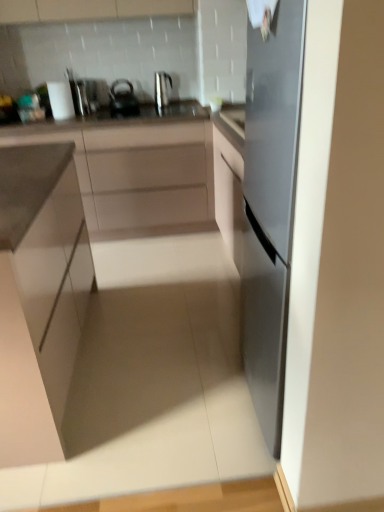
Question: Is metallic silver kettle at upper center not close to matte white cabinet at left, which appears as the 1th cabinetry when viewed from the front?

Choices:
 (A) yes
 (B) no

Answer: (A)

Question: From the image's perspective, would you say metallic silver kettle at upper center is positioned over matte white cabinet at left, which appears as the 1th cabinetry when viewed from the front?

Choices:
 (A) no
 (B) yes

Answer: (B)

Question: From the image's perspective, would you say metallic silver kettle at upper center is shown under matte white cabinet at left, the 2th cabinetry when ordered from back to front?

Choices:
 (A) yes
 (B) no

Answer: (B)

Question: Can you confirm if metallic silver kettle at upper center is taller than matte white cabinet at left, which appears as the 1th cabinetry when viewed from the front?

Choices:
 (A) yes
 (B) no

Answer: (B)

Question: Does metallic silver kettle at upper center lie behind matte white cabinet at left, which appears as the 1th cabinetry when viewed from the front?

Choices:
 (A) yes
 (B) no

Answer: (A)

Question: Relative to matte white cabinet at left, which appears as the 1th cabinetry when viewed from the front, is metallic silver kettle at upper center in front or behind?

Choices:
 (A) behind
 (B) front

Answer: (A)

Question: Is metallic silver kettle at upper center inside the boundaries of matte white cabinet at left, the 2th cabinetry when ordered from back to front, or outside?

Choices:
 (A) outside
 (B) inside

Answer: (A)

Question: Considering the positions of point (165, 77) and point (48, 422), is point (165, 77) closer or farther from the camera than point (48, 422)?

Choices:
 (A) farther
 (B) closer

Answer: (A)

Question: From a real-world perspective, is metallic silver kettle at upper center physically located above or below matte white cabinet at left, the 2th cabinetry when ordered from back to front?

Choices:
 (A) above
 (B) below

Answer: (A)

Question: Is satin silver toaster at upper left wider or thinner than matte black kettle at upper center?

Choices:
 (A) wide
 (B) thin

Answer: (B)

Question: Considering the positions of satin silver toaster at upper left and matte black kettle at upper center in the image, is satin silver toaster at upper left taller or shorter than matte black kettle at upper center?

Choices:
 (A) tall
 (B) short

Answer: (A)

Question: Is satin silver toaster at upper left in front of or behind matte black kettle at upper center in the image?

Choices:
 (A) front
 (B) behind

Answer: (B)

Question: From a real-world perspective, is satin silver toaster at upper left positioned above or below matte black kettle at upper center?

Choices:
 (A) above
 (B) below

Answer: (A)

Question: Is metallic silver kettle at upper center wider or thinner than matte black kettle at upper center?

Choices:
 (A) thin
 (B) wide

Answer: (A)

Question: Based on their positions, is metallic silver kettle at upper center located to the left or right of matte black kettle at upper center?

Choices:
 (A) right
 (B) left

Answer: (A)